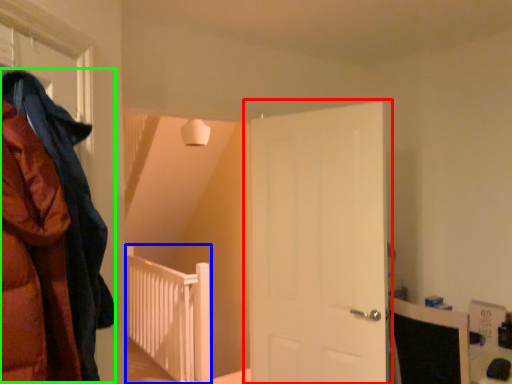
Question: Which object is the farthest from door (highlighted by a red box)? Choose among these: rail (highlighted by a blue box) or cloak (highlighted by a green box).

Choices:
 (A) rail
 (B) cloak

Answer: (A)